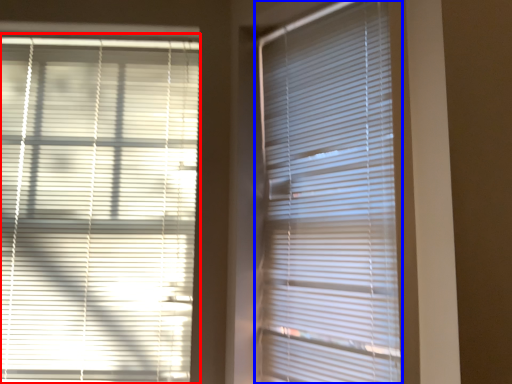
Question: Which object appears farthest to the camera in this image, window blind (highlighted by a red box) or window blind (highlighted by a blue box)?

Choices:
 (A) window blind
 (B) window blind

Answer: (A)